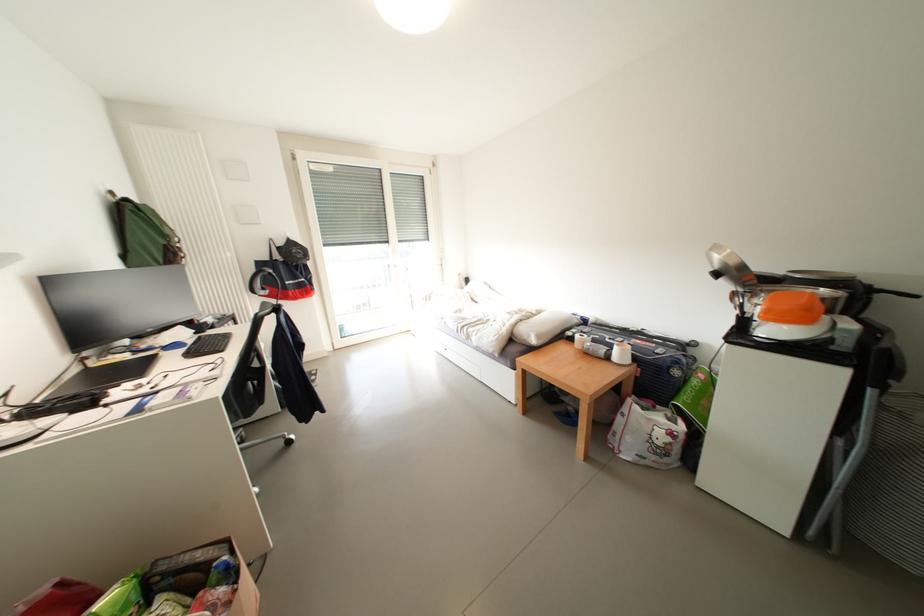
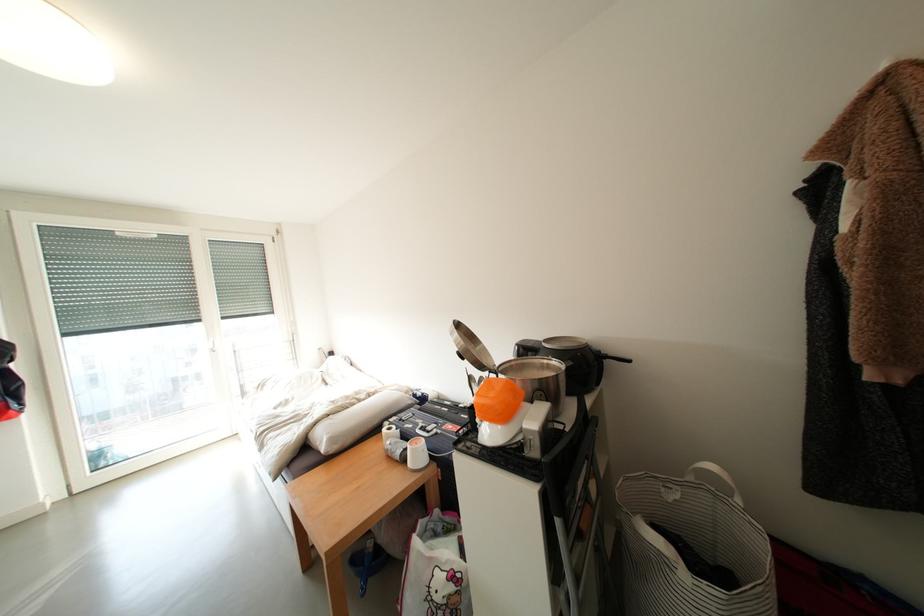
Locate, in the second image, the point that corresponds to (628,358) in the first image.

(424, 456)